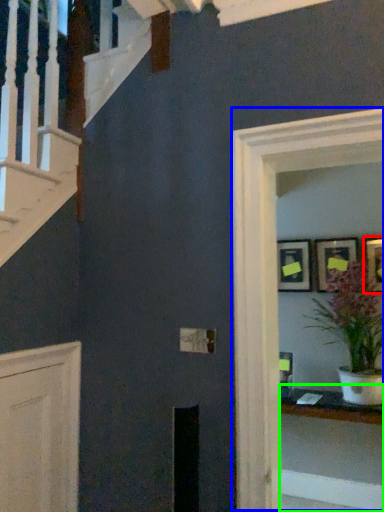
Question: Considering the real-world distances, which object is farthest from picture frame (highlighted by a red box)? glass door (highlighted by a blue box) or table (highlighted by a green box)?

Choices:
 (A) glass door
 (B) table

Answer: (A)